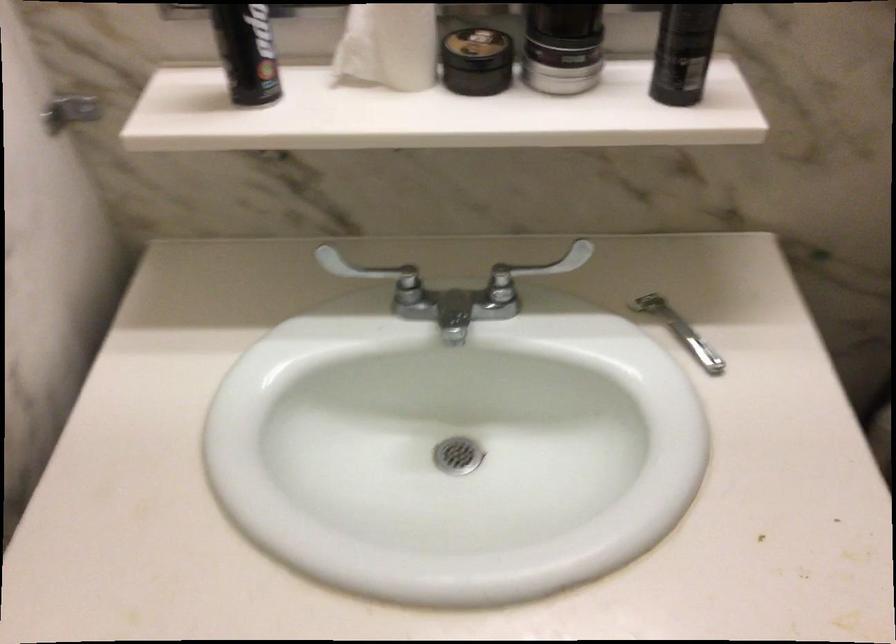
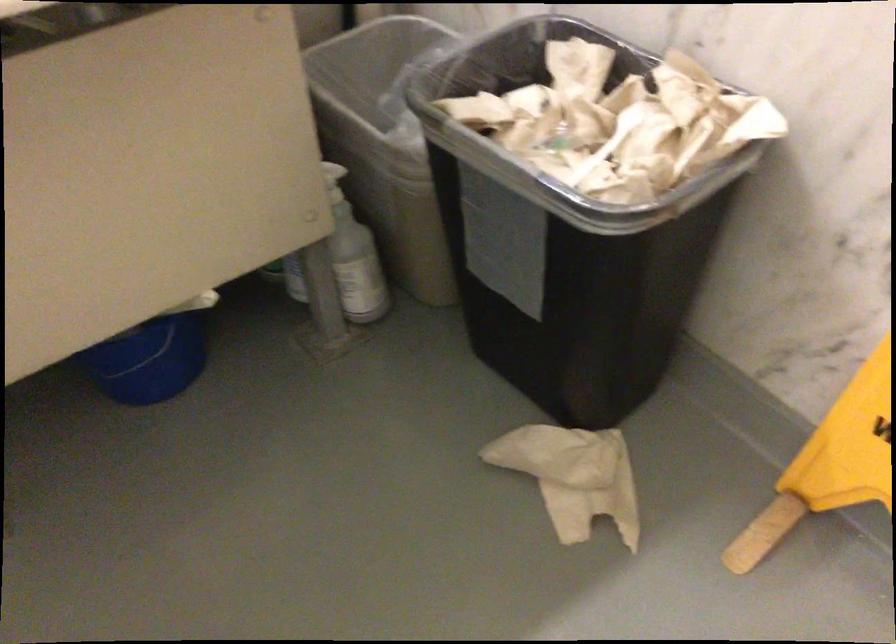
Question: The first image is from the beginning of the video and the second image is from the end. How did the camera likely rotate when shooting the video?

Choices:
 (A) Left
 (B) Right
 (C) Up
 (D) Down

Answer: (B)